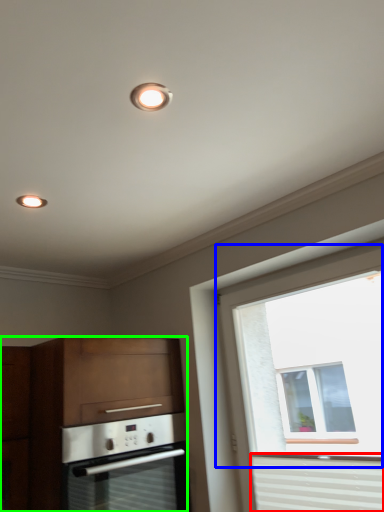
Question: Which object is positioned closest to curtain (highlighted by a red box)? Select from window (highlighted by a blue box) and cabinetry (highlighted by a green box).

Choices:
 (A) window
 (B) cabinetry

Answer: (B)